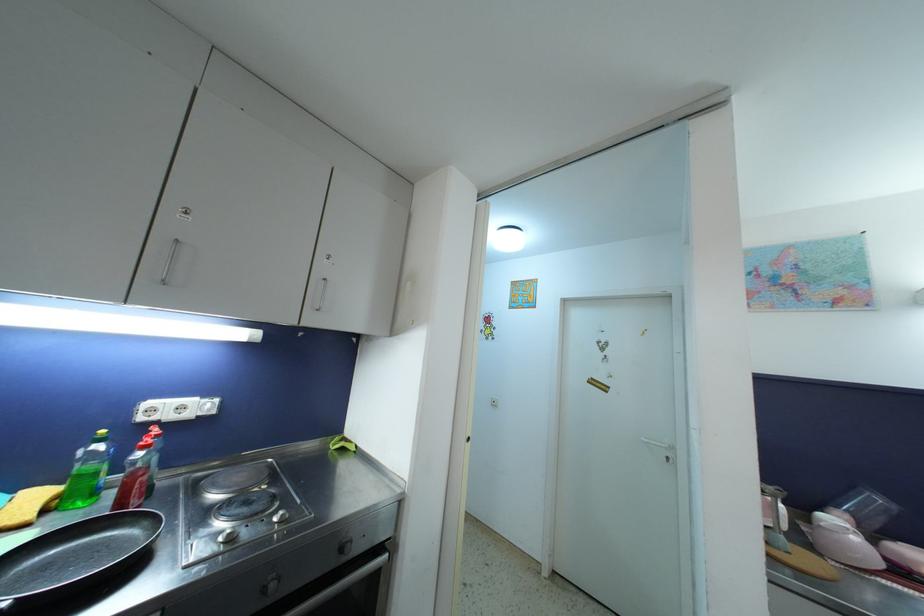
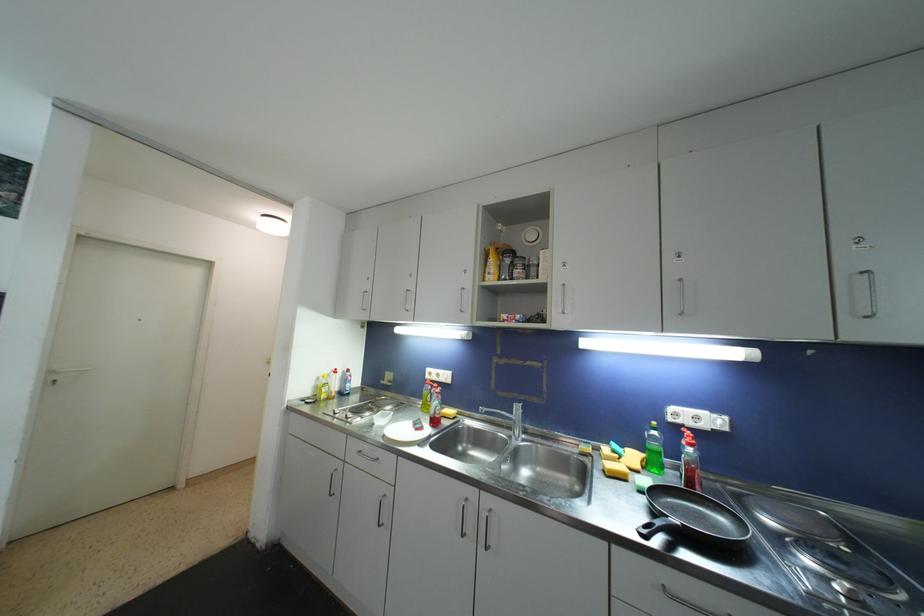
Find the pixel in the second image that matches [191,418] in the first image.

(708, 429)